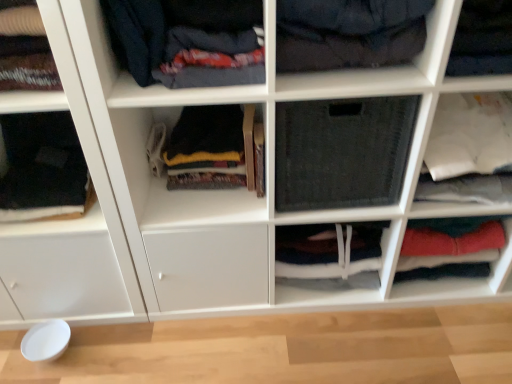
Question: Considering the relative positions of black fabric at left, marked as the first clothing in a left-to-right arrangement, and dark blue fabric at upper center, which is the third shelf in left-to-right order, in the image provided, is black fabric at left, marked as the first clothing in a left-to-right arrangement, to the right of dark blue fabric at upper center, which is the third shelf in left-to-right order, from the viewer's perspective?

Choices:
 (A) yes
 (B) no

Answer: (B)

Question: From a real-world perspective, is black fabric at left, the fourth clothing positioned from the right, positioned over dark blue fabric at upper center, which is the third shelf in left-to-right order, based on gravity?

Choices:
 (A) yes
 (B) no

Answer: (B)

Question: Does black fabric at left, marked as the first clothing in a left-to-right arrangement, lie behind dark blue fabric at upper center, which is the third shelf in left-to-right order?

Choices:
 (A) yes
 (B) no

Answer: (A)

Question: Considering the relative sizes of black fabric at left, the fourth clothing positioned from the right, and dark blue fabric at upper center, placed as the third shelf when sorted from right to left, in the image provided, is black fabric at left, the fourth clothing positioned from the right, taller than dark blue fabric at upper center, placed as the third shelf when sorted from right to left,?

Choices:
 (A) yes
 (B) no

Answer: (A)

Question: Is black fabric at left, the fourth clothing positioned from the right, positioned far away from dark blue fabric at upper center, placed as the third shelf when sorted from right to left?

Choices:
 (A) no
 (B) yes

Answer: (A)

Question: Choose the correct answer: Is dark gray fleece sweater at center, which ranks as the 3th clothing in right-to-left order, inside black fabric at center, the first clothing viewed from the right, or outside it?

Choices:
 (A) outside
 (B) inside

Answer: (A)

Question: Considering the positions of dark gray fleece sweater at center, the second clothing when ordered from left to right, and black fabric at center, placed as the 4th clothing when sorted from left to right, in the image, is dark gray fleece sweater at center, the second clothing when ordered from left to right, wider or thinner than black fabric at center, placed as the 4th clothing when sorted from left to right,?

Choices:
 (A) wide
 (B) thin

Answer: (B)

Question: Relative to black fabric at center, placed as the 4th clothing when sorted from left to right, is dark gray fleece sweater at center, the second clothing when ordered from left to right, in front or behind?

Choices:
 (A) front
 (B) behind

Answer: (B)

Question: Is dark gray fleece sweater at center, the second clothing when ordered from left to right, to the left or to the right of black fabric at center, placed as the 4th clothing when sorted from left to right, in the image?

Choices:
 (A) left
 (B) right

Answer: (A)

Question: Considering the relative positions of dark blue fabric at upper center, placed as the third shelf when sorted from right to left, and black fabric at center, the first clothing viewed from the right, in the image provided, is dark blue fabric at upper center, placed as the third shelf when sorted from right to left, to the left or to the right of black fabric at center, the first clothing viewed from the right,?

Choices:
 (A) right
 (B) left

Answer: (B)

Question: Is dark blue fabric at upper center, which is the third shelf in left-to-right order, in front of or behind black fabric at center, the first clothing viewed from the right, in the image?

Choices:
 (A) behind
 (B) front

Answer: (B)

Question: Considering the positions of dark blue fabric at upper center, which is the third shelf in left-to-right order, and black fabric at center, placed as the 4th clothing when sorted from left to right, in the image, is dark blue fabric at upper center, which is the third shelf in left-to-right order, taller or shorter than black fabric at center, placed as the 4th clothing when sorted from left to right,?

Choices:
 (A) tall
 (B) short

Answer: (B)

Question: Based on their sizes in the image, would you say dark blue fabric at upper center, which is the third shelf in left-to-right order, is bigger or smaller than black fabric at center, the first clothing viewed from the right?

Choices:
 (A) small
 (B) big

Answer: (A)

Question: Looking at the image, does dark gray fabric at center, the second cabinet viewed from the right, seem bigger or smaller compared to dark blue fabric at upper left, arranged as the second clothing when viewed from the right?

Choices:
 (A) big
 (B) small

Answer: (B)

Question: From their relative heights in the image, would you say dark gray fabric at center, the second cabinet viewed from the right, is taller or shorter than dark blue fabric at upper left, arranged as the second clothing when viewed from the right?

Choices:
 (A) short
 (B) tall

Answer: (B)